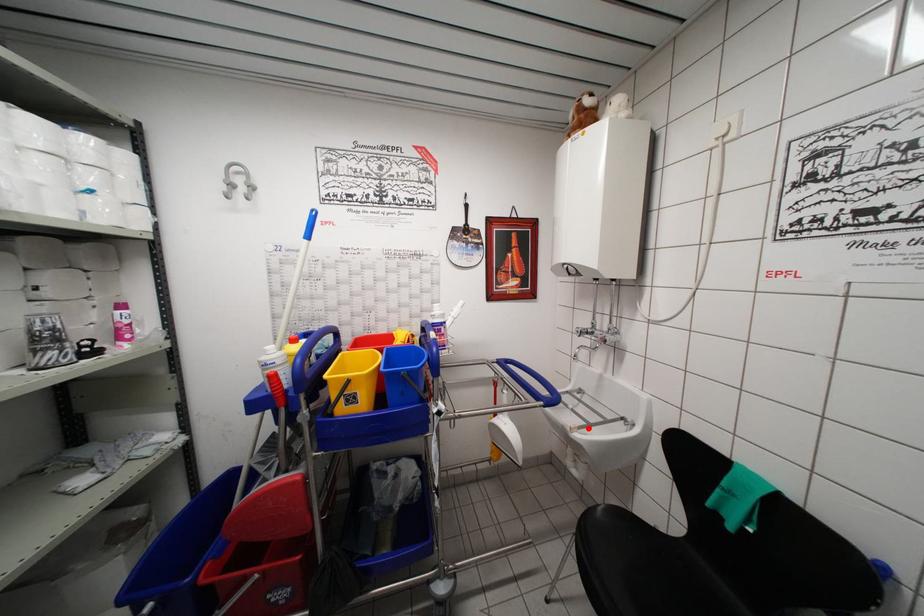
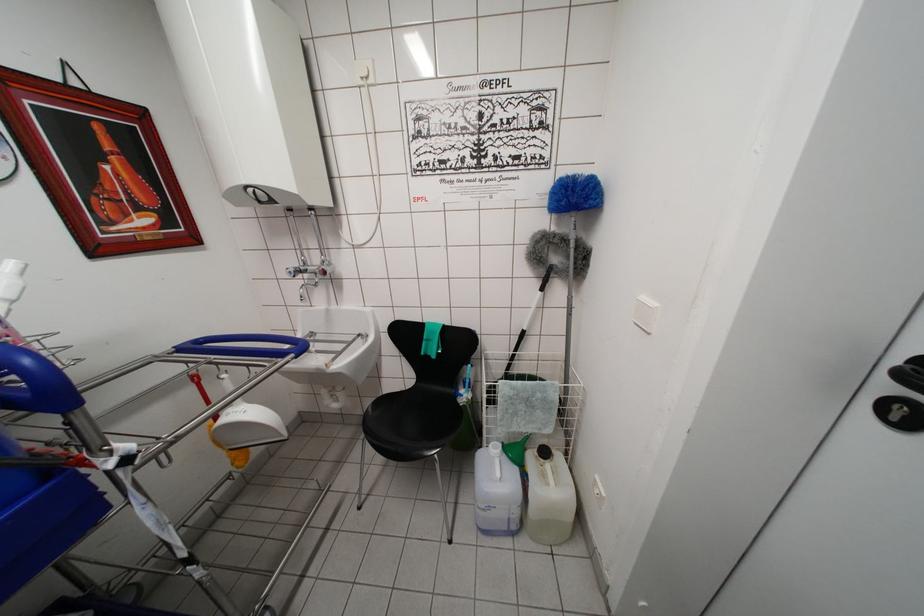
Where in the second image is the point corresponding to the highlighted location from the first image?

(338, 360)